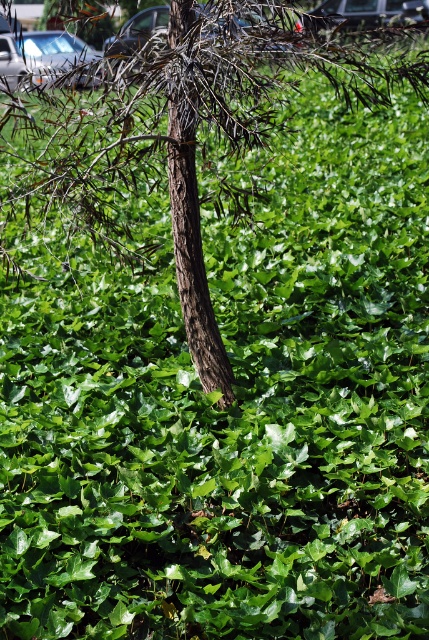
Question: Is brown rough bark tree at center bigger than metallic silver car at upper center?

Choices:
 (A) yes
 (B) no

Answer: (B)

Question: Which point is closer to the camera?

Choices:
 (A) brown rough bark tree at center
 (B) metallic silver car at upper center
 (C) metallic silver car at upper left

Answer: (A)

Question: Which object appears farthest from the camera in this image?

Choices:
 (A) metallic silver car at upper left
 (B) brown rough bark tree at center

Answer: (A)

Question: In this image, where is metallic silver car at upper left located relative to metallic silver car at upper center?

Choices:
 (A) right
 (B) left

Answer: (B)

Question: Which of the following is the farthest from the observer?

Choices:
 (A) metallic silver car at upper center
 (B) brown rough bark tree at center

Answer: (A)

Question: Is brown rough bark tree at center bigger than metallic silver car at upper left?

Choices:
 (A) no
 (B) yes

Answer: (A)